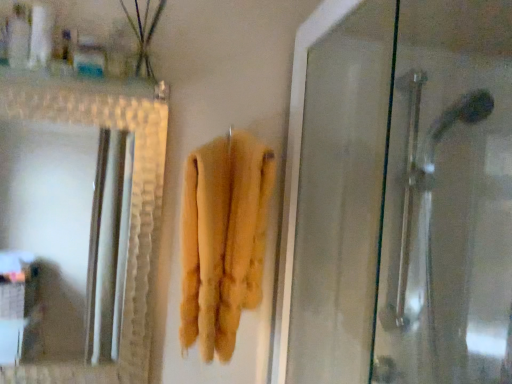
Question: Looking at their shapes, would you say green matte plant at upper left is wider or thinner than translucent plastic container at upper left, the first toiletry viewed from the right?

Choices:
 (A) thin
 (B) wide

Answer: (A)

Question: From a real-world perspective, is green matte plant at upper left positioned above or below translucent plastic container at upper left, the first toiletry viewed from the right?

Choices:
 (A) below
 (B) above

Answer: (B)

Question: Estimate the real-world distances between objects in this image. Which object is closer to the green matte plant at upper left?

Choices:
 (A) yellow fluffy towel at center
 (B) white plastic container at upper left, the 1th toiletry when ordered from left to right
 (C) translucent plastic container at upper left, the first toiletry viewed from the right

Answer: (C)

Question: Estimate the real-world distances between objects in this image. Which object is closer to the translucent plastic container at upper left, arranged as the second toiletry when viewed from the left?

Choices:
 (A) green matte plant at upper left
 (B) yellow fluffy towel at center
 (C) white plastic container at upper left, which is counted as the 2th toiletry, starting from the right

Answer: (A)